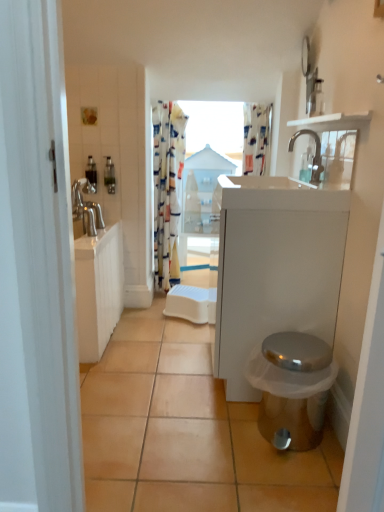
Question: Considering the relative sizes of shiny metallic toilet at lower right and patterned fabric shower curtain at upper center in the image provided, is shiny metallic toilet at lower right smaller than patterned fabric shower curtain at upper center?

Choices:
 (A) yes
 (B) no

Answer: (B)

Question: Is shiny metallic toilet at lower right facing away from patterned fabric shower curtain at upper center?

Choices:
 (A) no
 (B) yes

Answer: (A)

Question: Does shiny metallic toilet at lower right appear on the right side of patterned fabric shower curtain at upper center?

Choices:
 (A) no
 (B) yes

Answer: (A)

Question: Is shiny metallic toilet at lower right oriented towards patterned fabric shower curtain at upper center?

Choices:
 (A) yes
 (B) no

Answer: (B)

Question: From a real-world perspective, is shiny metallic toilet at lower right on patterned fabric shower curtain at upper center?

Choices:
 (A) yes
 (B) no

Answer: (B)

Question: Based on their sizes in the image, would you say white glossy cabinet at center is bigger or smaller than silver metallic faucet at upper center?

Choices:
 (A) big
 (B) small

Answer: (A)

Question: In the image, is white glossy cabinet at center positioned in front of or behind silver metallic faucet at upper center?

Choices:
 (A) front
 (B) behind

Answer: (A)

Question: From a real-world perspective, is white glossy cabinet at center positioned above or below silver metallic faucet at upper center?

Choices:
 (A) below
 (B) above

Answer: (A)

Question: In terms of height, does white glossy cabinet at center look taller or shorter compared to silver metallic faucet at upper center?

Choices:
 (A) tall
 (B) short

Answer: (A)

Question: Is white glossy cabinet at center in front of or behind orange matte tile at lower center in the image?

Choices:
 (A) behind
 (B) front

Answer: (A)

Question: From the image's perspective, is white glossy cabinet at center above or below orange matte tile at lower center?

Choices:
 (A) below
 (B) above

Answer: (B)

Question: Considering the positions of point (299, 313) and point (170, 498), is point (299, 313) closer or farther from the camera than point (170, 498)?

Choices:
 (A) farther
 (B) closer

Answer: (A)

Question: Do you think white glossy cabinet at center is within orange matte tile at lower center, or outside of it?

Choices:
 (A) inside
 (B) outside

Answer: (B)

Question: Considering the positions of translucent plastic soap dispenser at left and patterned fabric shower curtain at upper center in the image, is translucent plastic soap dispenser at left wider or thinner than patterned fabric shower curtain at upper center?

Choices:
 (A) thin
 (B) wide

Answer: (A)

Question: From a real-world perspective, is translucent plastic soap dispenser at left above or below patterned fabric shower curtain at upper center?

Choices:
 (A) below
 (B) above

Answer: (A)